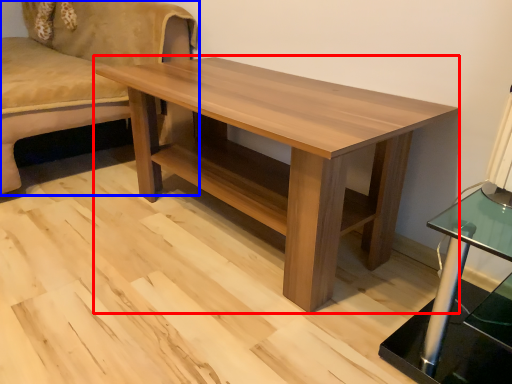
Question: Among these objects, which one is nearest to the camera, coffee table (highlighted by a red box) or studio couch (highlighted by a blue box)?

Choices:
 (A) coffee table
 (B) studio couch

Answer: (A)